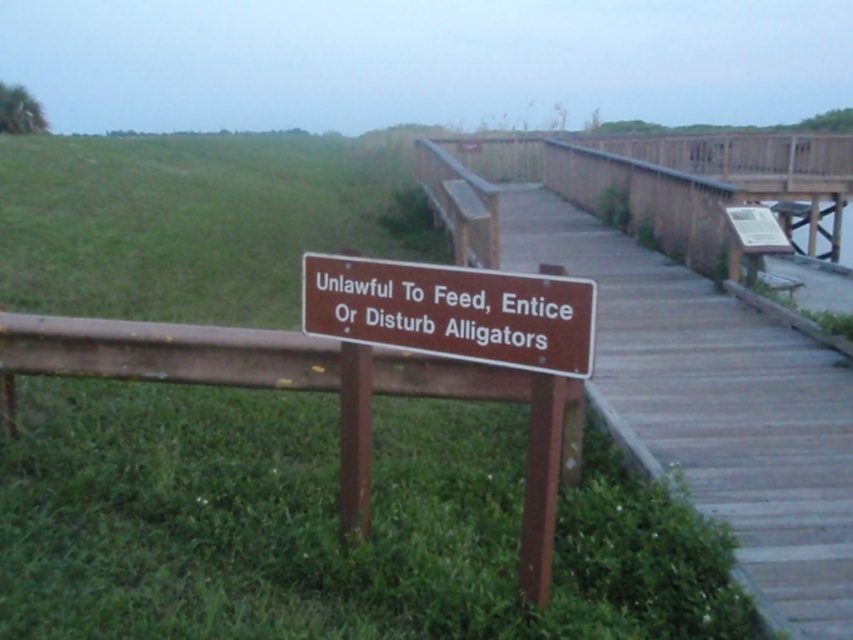
You are a visitor standing on the boardwalk and want to sit down. You see the brown wooden dock at center and the wooden bench at upper right. Which one is closer to you?

The brown wooden dock at center is closer to you because it is positioned over the wooden bench at upper right, meaning it is in front of it from your perspective.

You are a park ranger who needs to place a new bench on the brown wooden dock at center. The existing wooden bench at upper right is the same size as the new one. Can you fit the new bench on the dock without overlapping the existing bench?

The brown wooden dock at center has a larger width than the wooden bench at upper right, so yes, the new bench can be placed on the dock without overlapping the existing bench since there is enough space.